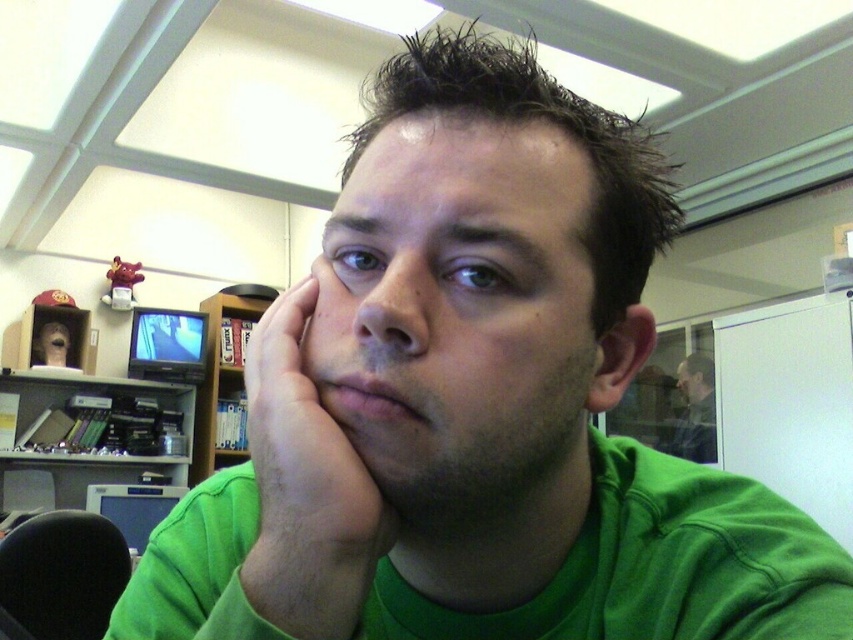
Question: Is green matte hand at center closer to the viewer compared to wooden bookshelf at upper center?

Choices:
 (A) yes
 (B) no

Answer: (A)

Question: Among these objects, which one is farthest from the camera?

Choices:
 (A) green matte head at center
 (B) matte green head at upper center

Answer: (B)

Question: Estimate the real-world distances between objects in this image. Which object is farther from the green matte head at center?

Choices:
 (A) matte black jacket at upper right
 (B) wooden bookshelf at upper center

Answer: (B)

Question: Is matte black jacket at upper right below matte green head at upper center?

Choices:
 (A) yes
 (B) no

Answer: (A)

Question: Which point is closer to the camera?

Choices:
 (A) green matte head at center
 (B) matte green head at upper center
 (C) matte black jacket at upper right
 (D) wooden bookshelf at upper center

Answer: (A)

Question: Does green matte head at center have a lesser width compared to matte green head at upper center?

Choices:
 (A) yes
 (B) no

Answer: (B)